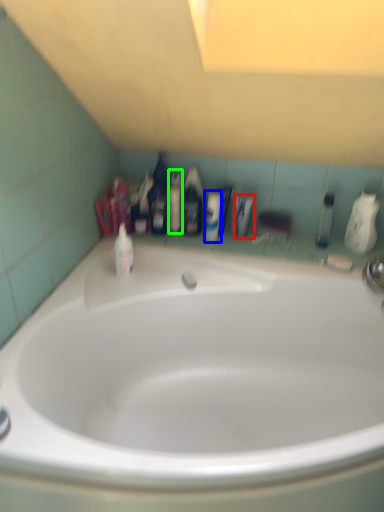
Question: Estimate the real-world distances between objects in this image. Which object is closer to toiletry (highlighted by a red box), toiletry (highlighted by a blue box) or mouthwash (highlighted by a green box)?

Choices:
 (A) toiletry
 (B) mouthwash

Answer: (A)